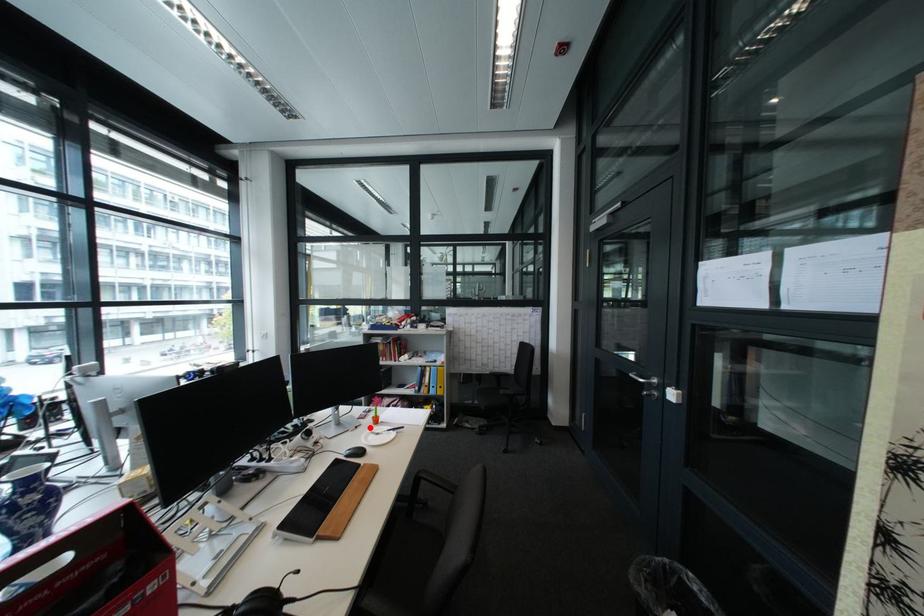
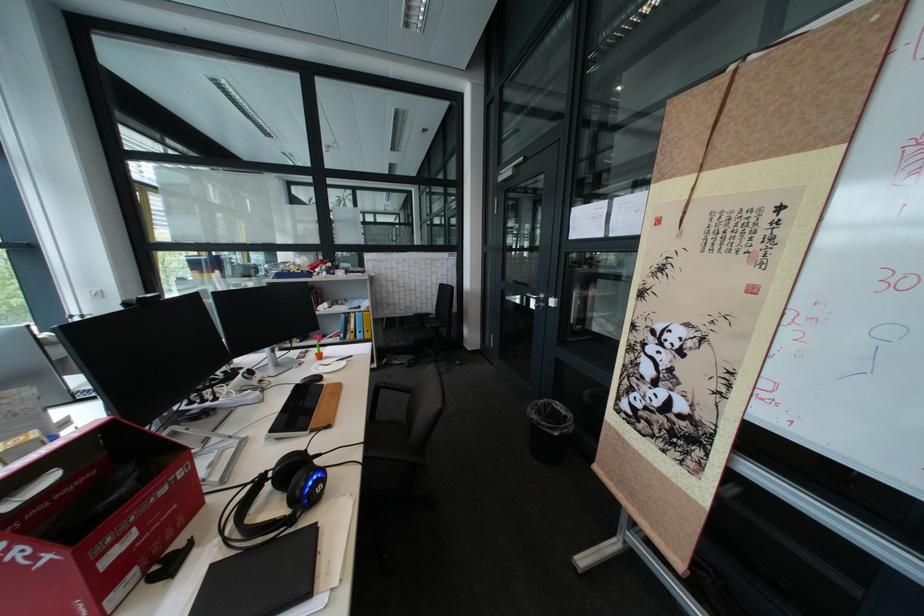
The point at the highlighted location is marked in the first image. Where is the corresponding point in the second image?

(313, 365)